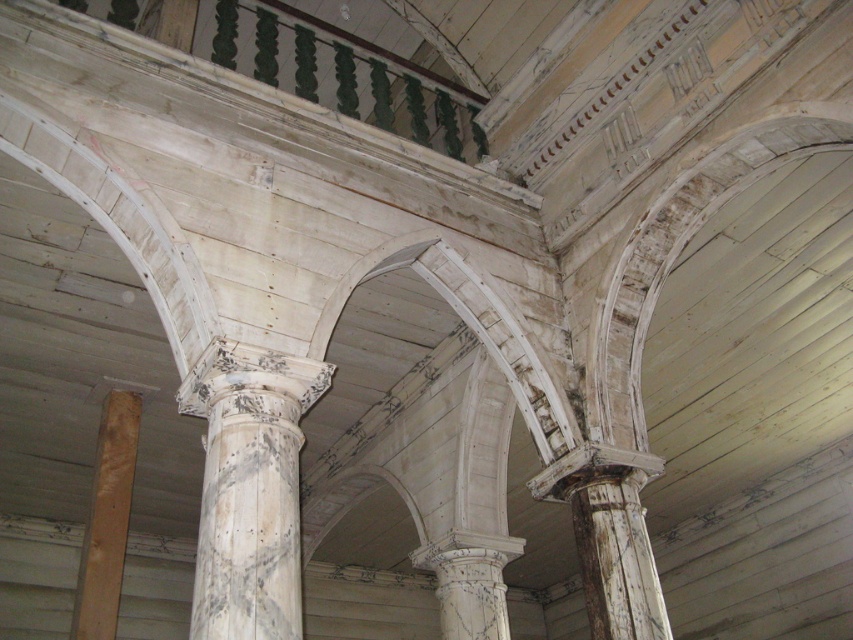
You are an architect examining this historical structure. You need to determine which object is smaller between the white weathered column at center and the light brown wood at lower left. Can you identify the smaller one?

The white weathered column at center is smaller compared to the light brown wood at lower left.

You are a maintenance worker needing to reach the white weathered column at center from the light brown wood at lower left. Given that your ladder is 4 meters long, will it be sufficient to bridge the gap between them?

The distance between the white weathered column at center and the light brown wood at lower left is 4.17 meters. Since the ladder is only 4 meters long, it will not be sufficient to bridge the gap between them.

You are an architect analyzing the structural integrity of the white weathered column at center located at point (248, 488). Based on the scene description, what potential issue might you identify with this column?

The white weathered column at center has visible signs of wear and moisture damage, which could compromise its structural integrity.